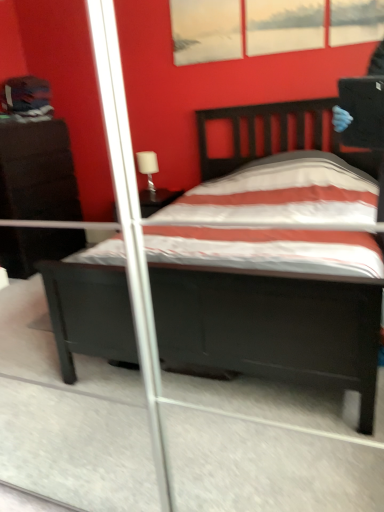
What is the approximate width of matte black bed at center?

26.81 inches.

Measure the distance between point (335, 357) and camera.

Point (335, 357) is 5.25 feet away from camera.

Locate an element on the screen. This screenshot has height=512, width=384. matte black bed at center is located at coordinates (272, 327).

The image size is (384, 512). Describe the element at coordinates (272, 327) in the screenshot. I see `matte black bed at center` at that location.

Where is `matte black bed at center`? This screenshot has width=384, height=512. matte black bed at center is located at coordinates (272, 327).